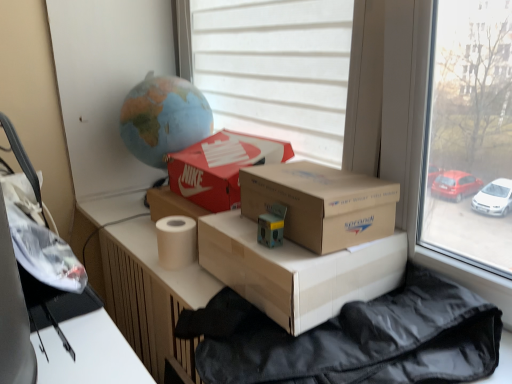
Measure the distance between point (x=156, y=227) and camera.

The depth of point (x=156, y=227) is 1.13 meters.

What do you see at coordinates (272, 67) in the screenshot?
I see `white matte window at center, the second window viewed from the right` at bounding box center [272, 67].

Describe the element at coordinates (271, 226) in the screenshot. I see `matte green plastic toy at center` at that location.

What do you see at coordinates (321, 203) in the screenshot? The width and height of the screenshot is (512, 384). I see `brown cardboard box at center, arranged as the 2th box when ordered from the bottom` at bounding box center [321, 203].

Locate an element on the screen. The width and height of the screenshot is (512, 384). matte cardboard box at center, which is the first box from top to bottom is located at coordinates (220, 167).

Where is `white cardboard box at center`? The width and height of the screenshot is (512, 384). white cardboard box at center is located at coordinates (138, 277).

Image resolution: width=512 pixels, height=384 pixels. What do you see at coordinates (297, 271) in the screenshot?
I see `matte cardboard box at center, the 1th box positioned from the bottom` at bounding box center [297, 271].

Find the location of a particular element. beige matte toilet paper at center is located at coordinates (176, 241).

Is matte green plastic toy at center smaller than brown cardboard box at center, the 2th box from the top?

Indeed, matte green plastic toy at center has a smaller size compared to brown cardboard box at center, the 2th box from the top.

Between matte green plastic toy at center and brown cardboard box at center, arranged as the 2th box when ordered from the bottom, which one has larger width?

Wider between the two is brown cardboard box at center, arranged as the 2th box when ordered from the bottom.

Considering the positions of objects matte green plastic toy at center and brown cardboard box at center, arranged as the 2th box when ordered from the bottom, in the image provided, who is more to the right, matte green plastic toy at center or brown cardboard box at center, arranged as the 2th box when ordered from the bottom,?

brown cardboard box at center, arranged as the 2th box when ordered from the bottom.

From the picture: Is white matte window at center, the 1th window from the left, positioned with its back to matte cardboard box at center, which is the first box from top to bottom?

white matte window at center, the 1th window from the left, is not turned away from matte cardboard box at center, which is the first box from top to bottom.

Between white matte window at center, the second window viewed from the right, and matte cardboard box at center, the 3th box in the bottom-to-top sequence, which one appears on the left side from the viewer's perspective?

matte cardboard box at center, the 3th box in the bottom-to-top sequence.

Is white matte window at center, the 1th window from the left, taller than matte cardboard box at center, the 3th box in the bottom-to-top sequence?

Indeed, white matte window at center, the 1th window from the left, has a greater height compared to matte cardboard box at center, the 3th box in the bottom-to-top sequence.

Is white matte window at center, the 1th window from the left, next to matte cardboard box at center, the 3th box in the bottom-to-top sequence?

No, white matte window at center, the 1th window from the left, is not touching matte cardboard box at center, the 3th box in the bottom-to-top sequence.

Considering the points (334, 292) and (170, 256), which point is in front, point (334, 292) or point (170, 256)?

The point (334, 292) is more forward.

Are matte cardboard box at center, which is the 3th box from top to bottom, and beige matte toilet paper at center far apart?

No, matte cardboard box at center, which is the 3th box from top to bottom, is not far from beige matte toilet paper at center.

Looking at this image, is matte cardboard box at center, the 1th box positioned from the bottom, to the right of beige matte toilet paper at center from the viewer's perspective?

Correct, you'll find matte cardboard box at center, the 1th box positioned from the bottom, to the right of beige matte toilet paper at center.

Is beige matte toilet paper at center at the back of matte cardboard box at center, which is the 3th box from top to bottom?

No, matte cardboard box at center, which is the 3th box from top to bottom, is not facing away from beige matte toilet paper at center.

From the image's perspective, which is below, brown cardboard box at center, arranged as the 2th box when ordered from the bottom, or transparent glass window at upper right, acting as the second window starting from the left?

brown cardboard box at center, arranged as the 2th box when ordered from the bottom, appears lower in the image.

Is point (291, 220) closer or farther from the camera than point (361, 30)?

Clearly, point (291, 220) is closer to the camera than point (361, 30).

Which object is wider, brown cardboard box at center, the 2th box from the top, or transparent glass window at upper right, acting as the second window starting from the left?

brown cardboard box at center, the 2th box from the top.

From the picture: Does brown cardboard box at center, the 2th box from the top, have a larger size compared to transparent glass window at upper right, acting as the 1th window starting from the right?

Actually, brown cardboard box at center, the 2th box from the top, might be smaller than transparent glass window at upper right, acting as the 1th window starting from the right.

Where is `table below the beige matte toilet paper at center (from a real-world perspective)`? Image resolution: width=512 pixels, height=384 pixels. table below the beige matte toilet paper at center (from a real-world perspective) is located at coordinates (138, 277).

From their relative heights in the image, would you say white cardboard box at center is taller or shorter than beige matte toilet paper at center?

Considering their sizes, white cardboard box at center has less height than beige matte toilet paper at center.

Is white cardboard box at center positioned far away from beige matte toilet paper at center?

No.

Looking at this image, is white cardboard box at center inside the boundaries of beige matte toilet paper at center, or outside?

white cardboard box at center is outside beige matte toilet paper at center.

From the image's perspective, who appears lower, matte cardboard box at center, the 1th box positioned from the bottom, or white cardboard box at center?

white cardboard box at center, from the image's perspective.

Is matte cardboard box at center, the 1th box positioned from the bottom, behind white cardboard box at center?

Yes, the depth of matte cardboard box at center, the 1th box positioned from the bottom, is greater than that of white cardboard box at center.

From a real-world perspective, is matte cardboard box at center, the 1th box positioned from the bottom, on top of white cardboard box at center?

Yes, from a real-world perspective, matte cardboard box at center, the 1th box positioned from the bottom, is above white cardboard box at center.

Considering the sizes of objects beige matte toilet paper at center and brown cardboard box at center, the 2th box from the top, in the image provided, who is shorter, beige matte toilet paper at center or brown cardboard box at center, the 2th box from the top,?

beige matte toilet paper at center is shorter.

Visually, is beige matte toilet paper at center positioned to the left or to the right of brown cardboard box at center, arranged as the 2th box when ordered from the bottom?

Based on their positions, beige matte toilet paper at center is located to the left of brown cardboard box at center, arranged as the 2th box when ordered from the bottom.

From a real-world perspective, is beige matte toilet paper at center below brown cardboard box at center, the 2th box from the top?

Correct, in the physical world, beige matte toilet paper at center is lower than brown cardboard box at center, the 2th box from the top.

Locate an element on the screen. The height and width of the screenshot is (384, 512). toy behind the brown cardboard box at center, the 2th box from the top is located at coordinates (271, 226).

Identify the location of box on the left of white matte window at center, the second window viewed from the right. (220, 167).

When comparing their distances from transparent glass window at upper right, acting as the 1th window starting from the right, does black synthetic sleeping bag at lower right or white cardboard box at center seem further?

The object further to transparent glass window at upper right, acting as the 1th window starting from the right, is white cardboard box at center.

Looking at the image, which one is located further to matte cardboard box at center, which is the 3th box from top to bottom, white cardboard box at center or transparent glass window at upper right, acting as the second window starting from the left?

white cardboard box at center is further to matte cardboard box at center, which is the 3th box from top to bottom.

Which object lies further to the anchor point brown cardboard box at center, arranged as the 2th box when ordered from the bottom, matte green plastic toy at center or beige matte toilet paper at center?

Based on the image, beige matte toilet paper at center appears to be further to brown cardboard box at center, arranged as the 2th box when ordered from the bottom.

From the image, which object appears to be nearer to matte green plastic toy at center, white matte window at center, the second window viewed from the right, or white cardboard box at center?

white matte window at center, the second window viewed from the right.

Which object lies nearer to the anchor point matte cardboard box at center, which is the 3th box from top to bottom, white cardboard box at center or beige matte toilet paper at center?

beige matte toilet paper at center is closer to matte cardboard box at center, which is the 3th box from top to bottom.

Which object lies nearer to the anchor point white matte window at center, the second window viewed from the right, white cardboard box at center or matte cardboard box at center, the 3th box in the bottom-to-top sequence?

matte cardboard box at center, the 3th box in the bottom-to-top sequence, is positioned closer to the anchor white matte window at center, the second window viewed from the right.

When comparing their distances from beige matte toilet paper at center, does brown cardboard box at center, the 2th box from the top, or transparent glass window at upper right, acting as the 1th window starting from the right, seem further?

transparent glass window at upper right, acting as the 1th window starting from the right, is further to beige matte toilet paper at center.

Considering their positions, is matte green plastic toy at center positioned closer to white matte window at center, the second window viewed from the right, than brown cardboard box at center, the 2th box from the top?

brown cardboard box at center, the 2th box from the top, is positioned closer to the anchor white matte window at center, the second window viewed from the right.

At what (x,y) coordinates should I click in order to perform the action: click on toy located between transparent glass window at upper right, acting as the second window starting from the left, and matte cardboard box at center, the 3th box in the bottom-to-top sequence, in the depth direction. Please return your answer as a coordinate pair (x, y). The width and height of the screenshot is (512, 384). Looking at the image, I should click on (271, 226).

The width and height of the screenshot is (512, 384). I want to click on table between black synthetic sleeping bag at lower right and matte green plastic toy at center in the front-back direction, so click(x=138, y=277).

Locate an element on the screen. The height and width of the screenshot is (384, 512). sleeping bag between white matte window at center, the second window viewed from the right, and white cardboard box at center from top to bottom is located at coordinates (358, 339).

Locate an element on the screen. The height and width of the screenshot is (384, 512). box between matte cardboard box at center, the 1th box positioned from the bottom, and matte cardboard box at center, the 3th box in the bottom-to-top sequence, in the front-back direction is located at coordinates (321, 203).